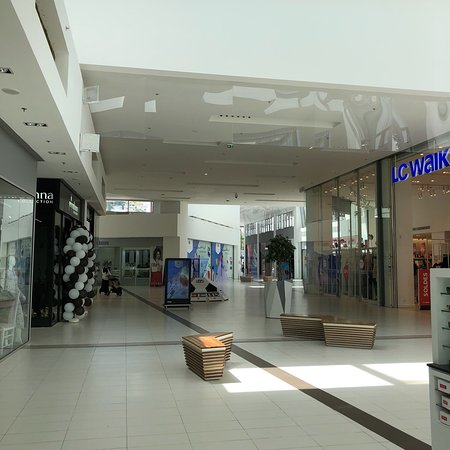
You are a GUI agent. You are given a task and a screenshot of the screen. Output one action in this format:
    pyautogui.click(x=<x>, y=<y>)
    Task: Click on the tile floor
    
    Given the screenshot: What is the action you would take?
    pyautogui.click(x=152, y=400), pyautogui.click(x=139, y=326), pyautogui.click(x=250, y=314), pyautogui.click(x=319, y=377)